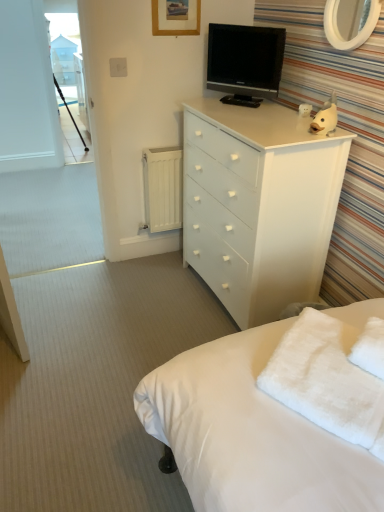
Locate an element on the screen. The height and width of the screenshot is (512, 384). blank space above white fluffy towel at lower right (from a real-world perspective) is located at coordinates (332, 345).